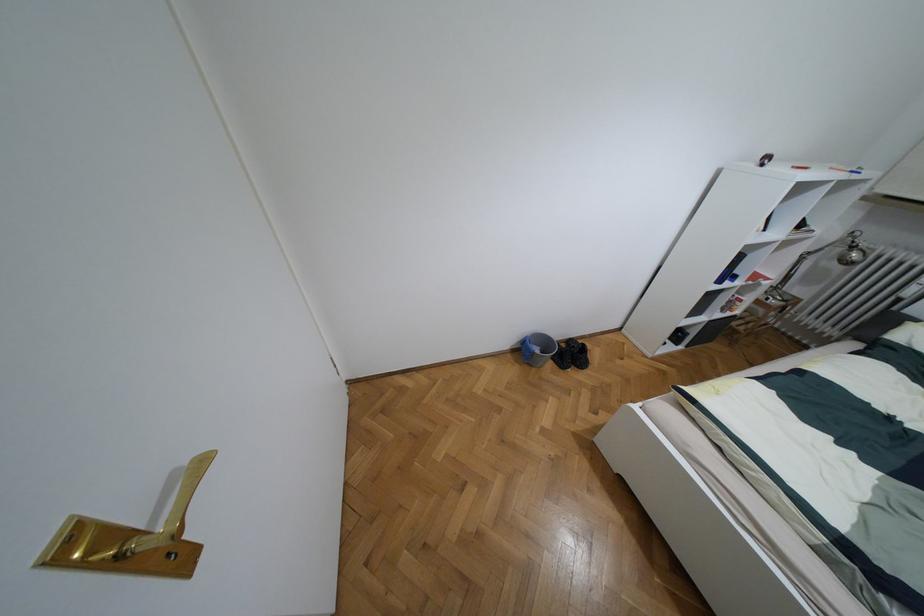
Find where to lift the gray bucket. Please return your answer as a coordinate pair (x, y).

(537, 349)